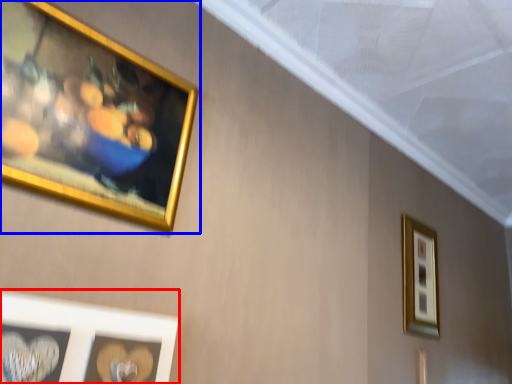
Question: Which point is further to the camera, picture frame (highlighted by a red box) or picture frame (highlighted by a blue box)?

Choices:
 (A) picture frame
 (B) picture frame

Answer: (B)